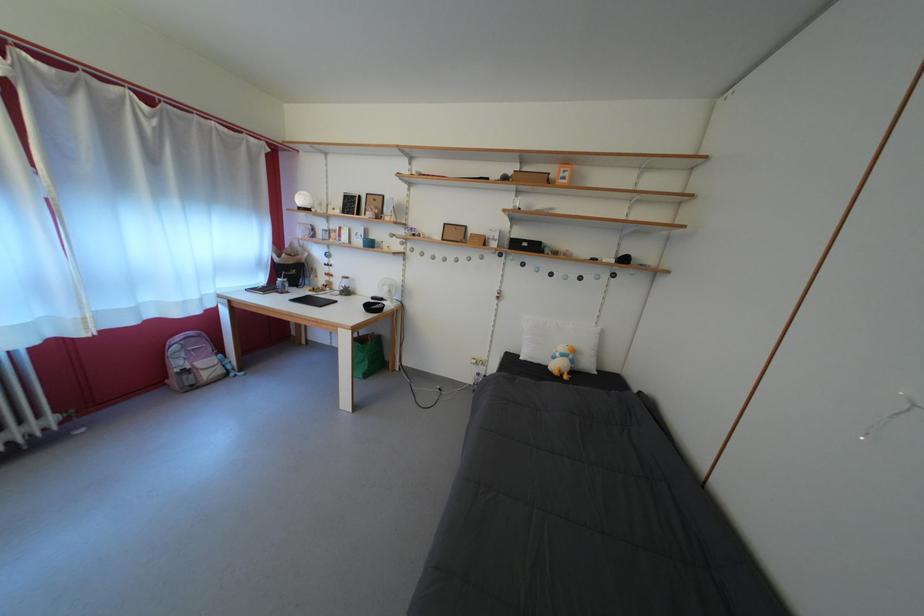
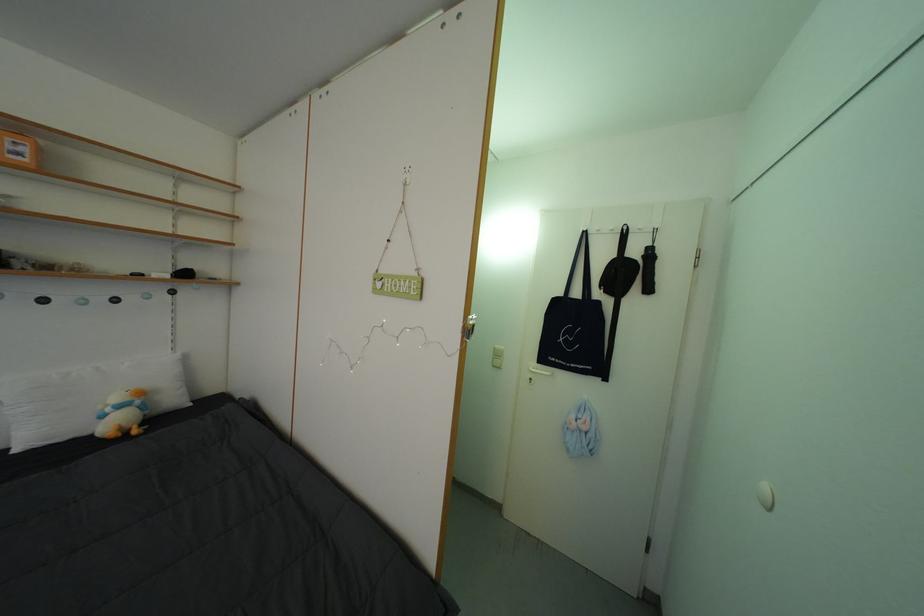
Question: The camera is either moving clockwise (left) or counter-clockwise (right) around the object. The first image is from the beginning of the video and the second image is from the end. Is the camera moving left or right when shooting the video?

Choices:
 (A) Left
 (B) Right

Answer: (A)